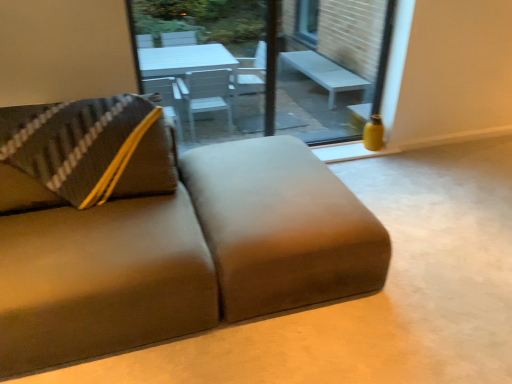
Question: Should I look upward or downward to see suede-like brown studio couch at lower left?

Choices:
 (A) up
 (B) down

Answer: (B)

Question: Can you confirm if suede-like brown studio couch at lower left is taller than matte glass window screen at center?

Choices:
 (A) no
 (B) yes

Answer: (A)

Question: From the image's perspective, does suede-like brown studio couch at lower left appear lower than matte glass window screen at center?

Choices:
 (A) yes
 (B) no

Answer: (A)

Question: From a real-world perspective, is suede-like brown studio couch at lower left on matte glass window screen at center?

Choices:
 (A) no
 (B) yes

Answer: (A)

Question: From the image's perspective, would you say suede-like brown studio couch at lower left is positioned over matte glass window screen at center?

Choices:
 (A) no
 (B) yes

Answer: (A)

Question: Is suede-like brown studio couch at lower left wider than matte glass window screen at center?

Choices:
 (A) no
 (B) yes

Answer: (B)

Question: Is suede-like brown studio couch at lower left facing away from matte glass window screen at center?

Choices:
 (A) yes
 (B) no

Answer: (B)

Question: From the image's perspective, is matte glass window screen at center under suede-like brown studio couch at lower left?

Choices:
 (A) no
 (B) yes

Answer: (A)

Question: From a real-world perspective, is matte glass window screen at center on suede-like brown studio couch at lower left?

Choices:
 (A) yes
 (B) no

Answer: (A)

Question: Does matte glass window screen at center lie in front of suede-like brown studio couch at lower left?

Choices:
 (A) yes
 (B) no

Answer: (B)

Question: Would you consider matte glass window screen at center to be distant from suede-like brown studio couch at lower left?

Choices:
 (A) no
 (B) yes

Answer: (B)

Question: Is matte glass window screen at center smaller than suede-like brown studio couch at lower left?

Choices:
 (A) yes
 (B) no

Answer: (A)

Question: Is matte glass window screen at center directly adjacent to suede-like brown studio couch at lower left?

Choices:
 (A) yes
 (B) no

Answer: (B)

Question: Considering the relative sizes of yellow matte vase at right and suede-like brown studio couch at lower left in the image provided, is yellow matte vase at right smaller than suede-like brown studio couch at lower left?

Choices:
 (A) no
 (B) yes

Answer: (B)